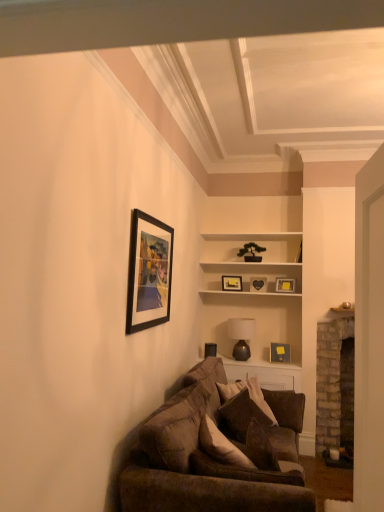
Question: Choose the correct answer: Is matte black picture frame at upper left, which ranks as the 3th picture frame in back-to-front order, inside brick fireplace at right or outside it?

Choices:
 (A) inside
 (B) outside

Answer: (B)

Question: Is matte black picture frame at upper left, which is the 6th picture frame in top-to-bottom order, taller or shorter than brick fireplace at right?

Choices:
 (A) short
 (B) tall

Answer: (A)

Question: Which of these objects is positioned closest to the black matte picture frame at upper left, the sixth picture frame positioned from the bottom?

Choices:
 (A) velvet brown couch at lower center
 (B) matte gray picture frame at upper center, which ranks as the 1th picture frame in back-to-front order
 (C) matte brown lamp at center
 (D) matte black picture frame at upper center, acting as the fifth picture frame starting from the front
 (E) matte black picture frame at upper left, the 1th picture frame when ordered from bottom to top

Answer: (A)

Question: Estimate the real-world distances between objects in this image. Which object is farther from the velvet brown couch at lower center?

Choices:
 (A) matte black picture frame at upper left, which is counted as the 2th picture frame, starting from the left
 (B) brick fireplace at right
 (C) matte black picture frame at upper center, the 3th picture frame positioned from the front
 (D) matte gray picture frame at upper center, which ranks as the 1th picture frame in back-to-front order
 (E) brown velvety pillow at center

Answer: (D)